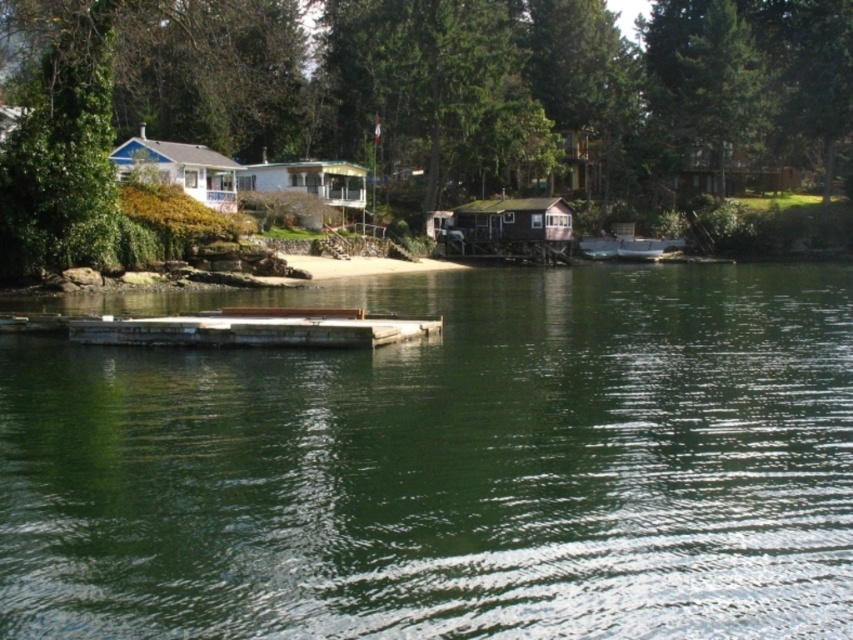
Question: Does green leafy tree at upper center have a smaller size compared to wooden boat at center?

Choices:
 (A) no
 (B) yes

Answer: (A)

Question: Which of the following is the farthest from the observer?

Choices:
 (A) green leafy tree at upper center
 (B) green smooth water at center
 (C) wooden boat at center
 (D) green leafy tree at left

Answer: (C)

Question: Which point is farther from the camera taking this photo?

Choices:
 (A) (267, 328)
 (B) (82, 131)

Answer: (B)

Question: Among these points, which one is nearest to the camera?

Choices:
 (A) (79, 65)
 (B) (137, 44)
 (C) (108, 339)

Answer: (C)

Question: In this image, where is green leafy tree at left located relative to wooden dock at center?

Choices:
 (A) left
 (B) right

Answer: (A)

Question: Can you confirm if green leafy tree at left is positioned above wooden dock at center?

Choices:
 (A) yes
 (B) no

Answer: (A)